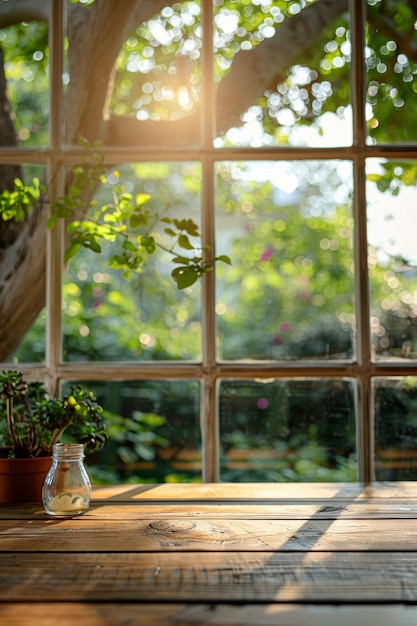
Image resolution: width=417 pixels, height=626 pixels. What are the coordinates of `window panes from top 2 rows` in the screenshot? It's located at (390, 93), (398, 185), (320, 200), (291, 109), (181, 99), (157, 193), (27, 201), (15, 118).